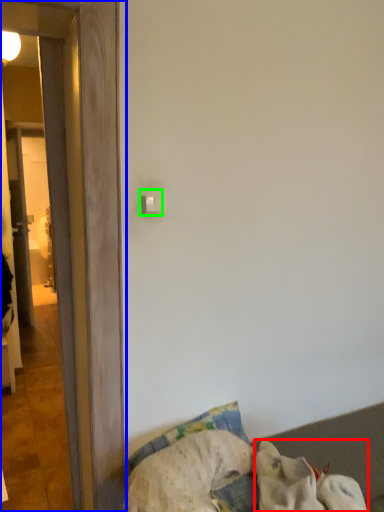
Question: Considering the real-world distances, which object is farthest from dog (highlighted by a red box)? door (highlighted by a blue box) or light switch (highlighted by a green box)?

Choices:
 (A) door
 (B) light switch

Answer: (B)